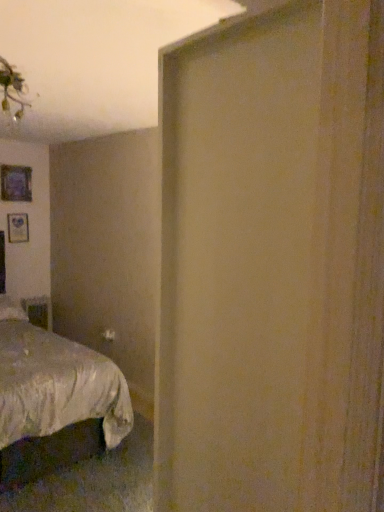
What is the approximate height of matte purple picture frame at upper left?

The height of matte purple picture frame at upper left is 37.91 centimeters.

What do you see at coordinates (16, 183) in the screenshot?
I see `matte purple picture frame at upper left` at bounding box center [16, 183].

The height and width of the screenshot is (512, 384). In order to click on matte purple picture frame at upper left in this screenshot , I will do `click(16, 183)`.

Where is `silky white bed at lower left`? The width and height of the screenshot is (384, 512). silky white bed at lower left is located at coordinates (55, 384).

What is the approximate height of silky white bed at lower left?

The height of silky white bed at lower left is 1.39 meters.

What do you see at coordinates (55, 384) in the screenshot? The height and width of the screenshot is (512, 384). I see `silky white bed at lower left` at bounding box center [55, 384].

Locate an element on the screen. The height and width of the screenshot is (512, 384). matte purple picture frame at upper left is located at coordinates (16, 183).

Does matte purple picture frame at upper left appear on the left side of silky white bed at lower left?

Yes, matte purple picture frame at upper left is to the left of silky white bed at lower left.

Is matte purple picture frame at upper left closer to camera compared to silky white bed at lower left?

No, matte purple picture frame at upper left is behind silky white bed at lower left.

Considering the points (21, 170) and (15, 429), which point is in front, point (21, 170) or point (15, 429)?

The point (15, 429) is more forward.

From the image's perspective, is matte purple picture frame at upper left above silky white bed at lower left?

Correct, matte purple picture frame at upper left appears higher than silky white bed at lower left in the image.

From a real-world perspective, which object rests below the other?

silky white bed at lower left, from a real-world perspective.

Considering the relative sizes of matte purple picture frame at upper left and silky white bed at lower left in the image provided, is matte purple picture frame at upper left thinner than silky white bed at lower left?

Indeed, matte purple picture frame at upper left has a lesser width compared to silky white bed at lower left.

From their relative heights in the image, would you say matte purple picture frame at upper left is taller or shorter than silky white bed at lower left?

Clearly, matte purple picture frame at upper left is shorter compared to silky white bed at lower left.

Who is smaller, matte purple picture frame at upper left or silky white bed at lower left?

matte purple picture frame at upper left is smaller.

Can silky white bed at lower left be found inside matte purple picture frame at upper left?

No, silky white bed at lower left is located outside of matte purple picture frame at upper left.

Is matte purple picture frame at upper left directly adjacent to silky white bed at lower left?

matte purple picture frame at upper left and silky white bed at lower left are not in contact.

Could you tell me if matte purple picture frame at upper left is turned towards silky white bed at lower left?

No.

What's the angular difference between matte purple picture frame at upper left and silky white bed at lower left's facing directions?

There is a 1.43-degree angle between the facing directions of matte purple picture frame at upper left and silky white bed at lower left.

Where is `picture frame above the silky white bed at lower left (from the image's perspective)`? The height and width of the screenshot is (512, 384). picture frame above the silky white bed at lower left (from the image's perspective) is located at coordinates (16, 183).

Is silky white bed at lower left to the right of matte purple picture frame at upper left from the viewer's perspective?

Indeed, silky white bed at lower left is positioned on the right side of matte purple picture frame at upper left.

Which object is further away from the camera, silky white bed at lower left or matte purple picture frame at upper left?

matte purple picture frame at upper left is more distant.

Considering the points (32, 396) and (0, 176), which point is behind, point (32, 396) or point (0, 176)?

The point (0, 176) is more distant.

In the scene shown: From the image's perspective, which is above, silky white bed at lower left or matte purple picture frame at upper left?

matte purple picture frame at upper left.

From a real-world perspective, which is physically below, silky white bed at lower left or matte purple picture frame at upper left?

silky white bed at lower left is physically lower.

Is silky white bed at lower left wider or thinner than matte purple picture frame at upper left?

Clearly, silky white bed at lower left has more width compared to matte purple picture frame at upper left.

In terms of height, does silky white bed at lower left look taller or shorter compared to matte purple picture frame at upper left?

Considering their sizes, silky white bed at lower left has more height than matte purple picture frame at upper left.

Does silky white bed at lower left have a larger size compared to matte purple picture frame at upper left?

Yes.

Would you say silky white bed at lower left is outside matte purple picture frame at upper left?

Yes, silky white bed at lower left is located beyond the bounds of matte purple picture frame at upper left.

Is silky white bed at lower left far from matte purple picture frame at upper left?

Yes, silky white bed at lower left and matte purple picture frame at upper left are located far from each other.

Consider the image. Is matte purple picture frame at upper left at the back of silky white bed at lower left?

Answer: No, matte purple picture frame at upper left is not at the back of silky white bed at lower left.

What's the angular difference between silky white bed at lower left and matte purple picture frame at upper left's facing directions?

They differ by 1.43 degrees in their facing directions.

Locate an element on the screen. This screenshot has width=384, height=512. picture frame lying on the left of silky white bed at lower left is located at coordinates (16, 183).

This screenshot has width=384, height=512. I want to click on picture frame above the silky white bed at lower left (from a real-world perspective), so click(x=16, y=183).

You are a GUI agent. You are given a task and a screenshot of the screen. Output one action in this format:
    pyautogui.click(x=<x>, y=<y>)
    Task: Click on the bed below the matte purple picture frame at upper left (from a real-world perspective)
    
    Given the screenshot: What is the action you would take?
    pyautogui.click(x=55, y=384)